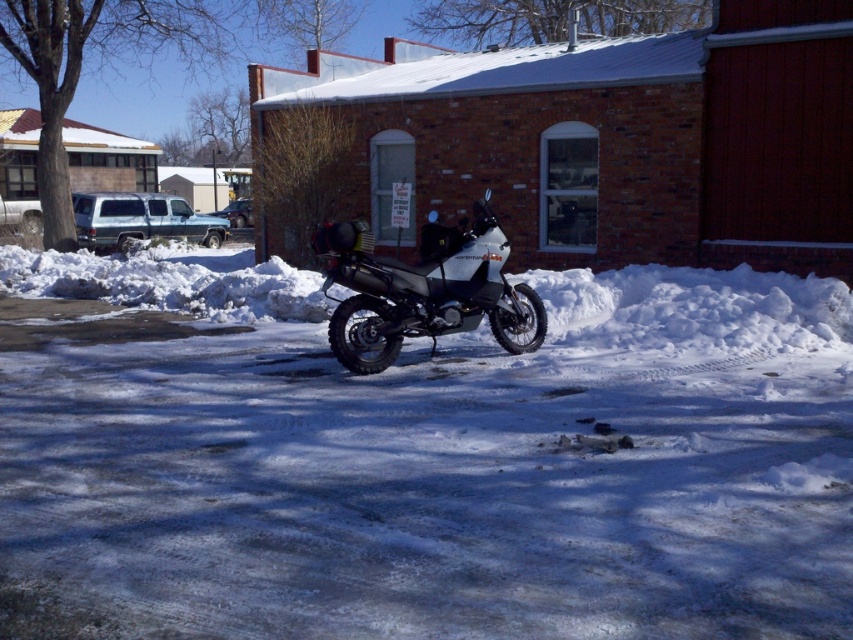
Is white powdery snow at center closer to camera compared to white matte adventure motorcycle at center?

Yes, it is in front of white matte adventure motorcycle at center.

Between point (339, 572) and point (393, 278), which one is positioned behind?

Positioned behind is point (393, 278).

Who is more forward, (813, 392) or (370, 301)?

Positioned in front is point (813, 392).

The width and height of the screenshot is (853, 640). Find the location of `white powdery snow at center`. white powdery snow at center is located at coordinates (439, 461).